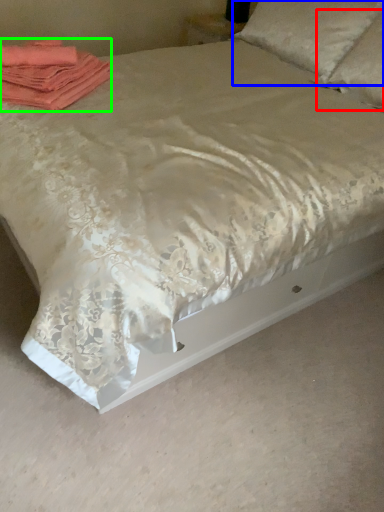
Question: Considering the real-world distances, which object is farthest from pillow (highlighted by a red box)? pillow (highlighted by a blue box) or material (highlighted by a green box)?

Choices:
 (A) pillow
 (B) material

Answer: (B)